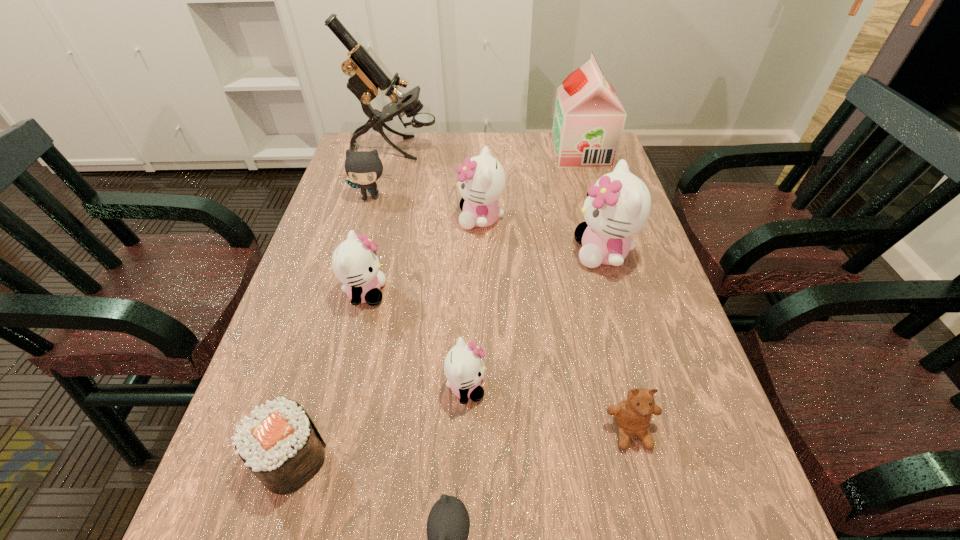
Where is `microscope that is at the left edge`? The height and width of the screenshot is (540, 960). microscope that is at the left edge is located at coordinates (366, 78).

Locate an element on the screen. This screenshot has height=540, width=960. sushi that is positioned at the left edge is located at coordinates (279, 443).

At what (x,y) coordinates should I click in order to perform the action: click on soya milk that is positioned at the right edge. Please return your answer as a coordinate pair (x, y). The width and height of the screenshot is (960, 540). Looking at the image, I should click on (589, 118).

You are a GUI agent. You are given a task and a screenshot of the screen. Output one action in this format:
    pyautogui.click(x=<x>, y=<y>)
    Task: Click on the kitten located at the right edge
    
    Given the screenshot: What is the action you would take?
    pyautogui.click(x=618, y=206)

Identify the location of teddy bear situated at the right edge. Image resolution: width=960 pixels, height=540 pixels. (633, 415).

You are a GUI agent. You are given a task and a screenshot of the screen. Output one action in this format:
    pyautogui.click(x=<x>, y=<y>)
    Task: Click on the object that is positioned at the far left corner
    Image resolution: width=960 pixels, height=540 pixels.
    Given the screenshot: What is the action you would take?
    pyautogui.click(x=366, y=78)

This screenshot has width=960, height=540. I want to click on object that is positioned at the far right corner, so click(589, 118).

Find the location of a particular element. This screenshot has width=960, height=540. free space at the far edge of the desktop is located at coordinates (468, 156).

In the image, there is a desktop. At what (x,y) coordinates should I click in order to perform the action: click on free region at the left edge. Please return your answer as a coordinate pair (x, y). Looking at the image, I should click on (275, 395).

Find the location of a particular element. vacant space at the right edge of the desktop is located at coordinates pos(636,367).